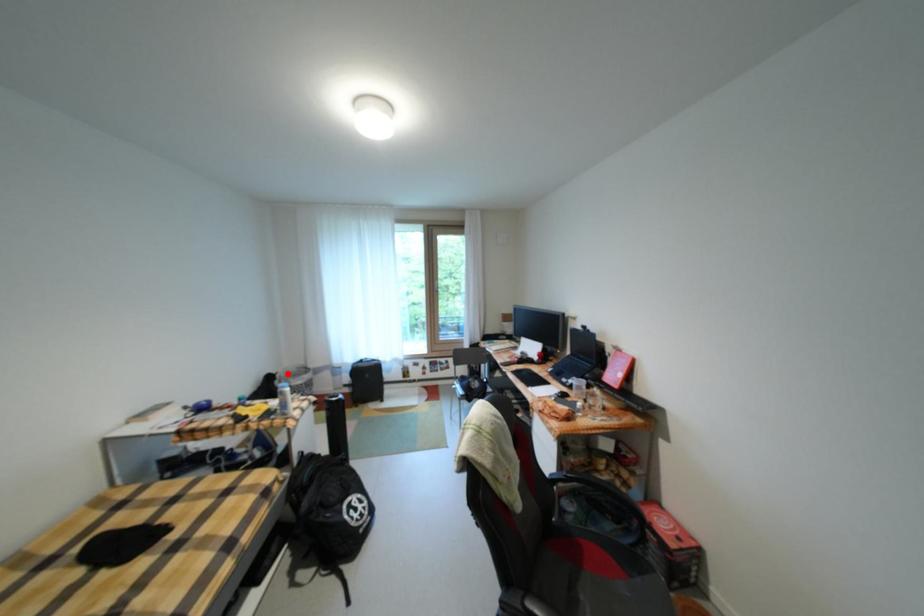
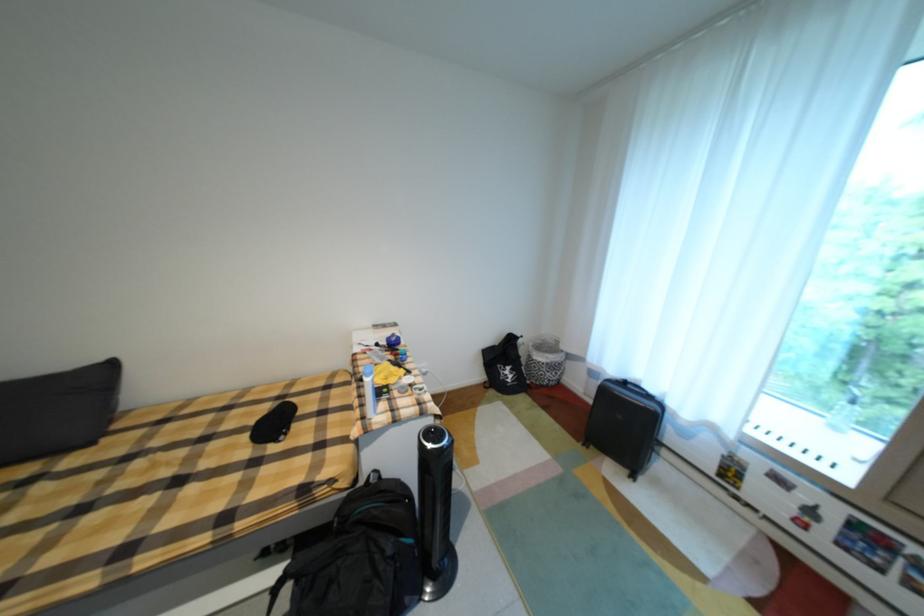
Locate, in the second image, the point that corresponds to the highlighted location in the first image.

(531, 338)